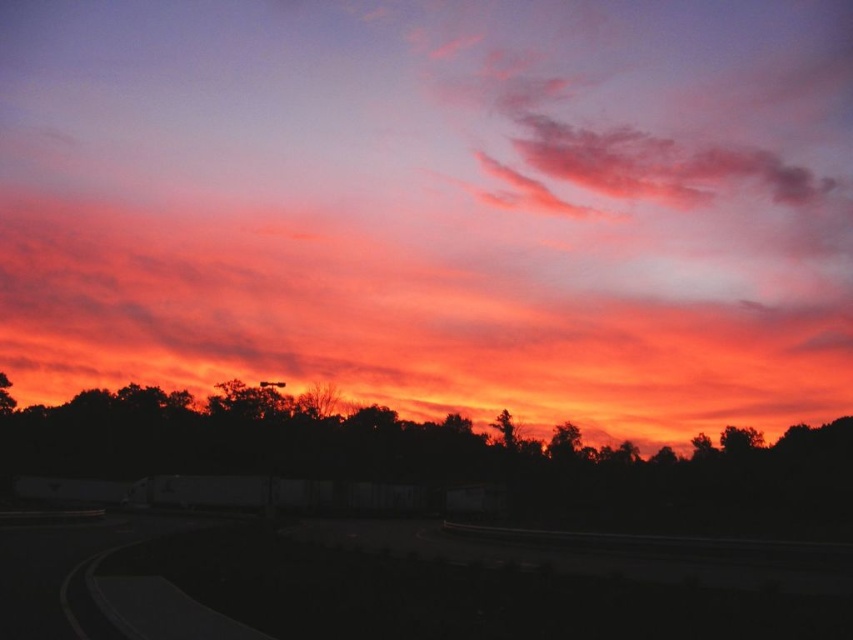
Question: Which of the following is the closest to the observer?

Choices:
 (A) silhouette tree at center
 (B) green leafy tree at center
 (C) matte orange cloud at upper center

Answer: (A)

Question: Is the position of matte orange cloud at upper center more distant than that of green leafy tree at center?

Choices:
 (A) yes
 (B) no

Answer: (A)

Question: Estimate the real-world distances between objects in this image. Which object is closer to the green leafy tree at center?

Choices:
 (A) black asphalt highway at lower center
 (B) matte orange cloud at upper center

Answer: (B)

Question: Which object is closer to the camera taking this photo?

Choices:
 (A) matte orange cloud at upper center
 (B) silhouette tree at center
 (C) green leafy tree at center
 (D) black asphalt highway at lower center

Answer: (D)

Question: Is black asphalt highway at lower center below silhouette tree at center?

Choices:
 (A) yes
 (B) no

Answer: (B)

Question: Does black asphalt highway at lower center have a lesser width compared to green leafy tree at center?

Choices:
 (A) no
 (B) yes

Answer: (A)